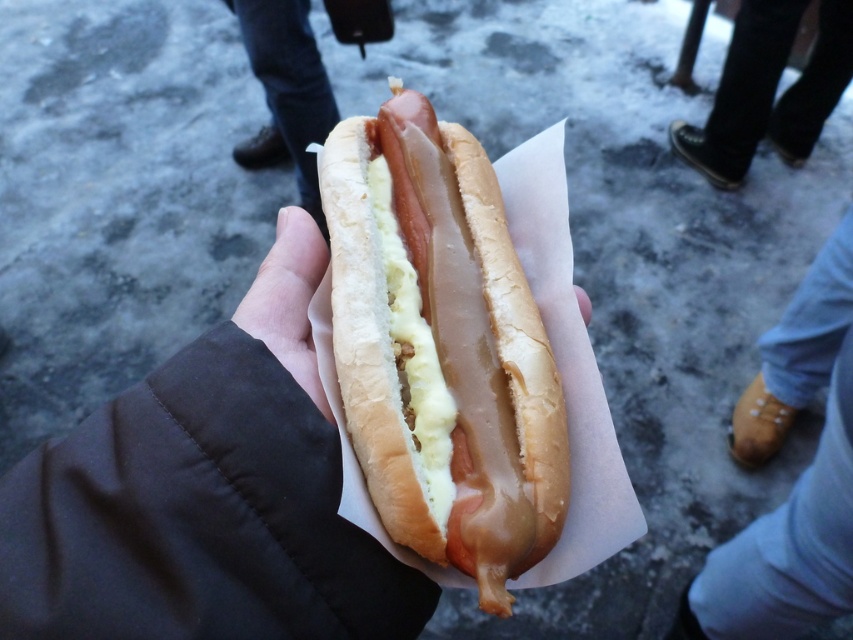
Does slightly toasted bun at center lie behind white smooth skin at center?

No, it is in front of white smooth skin at center.

Is slightly toasted bun at center to the left of white smooth skin at center from the viewer's perspective?

No, slightly toasted bun at center is not to the left of white smooth skin at center.

Is point (378, 147) farther from camera compared to point (248, 317)?

That is True.

The height and width of the screenshot is (640, 853). In order to click on slightly toasted bun at center in this screenshot , I will do `click(444, 349)`.

Who is lower down, slightly toasted bun at center or black leather shoes at lower right?

slightly toasted bun at center is below.

Which of these two, slightly toasted bun at center or black leather shoes at lower right, stands shorter?

Standing shorter between the two is slightly toasted bun at center.

Who is more forward, (465, 451) or (833, 42)?

Point (465, 451) is in front.

Find the location of a particular element. This screenshot has width=853, height=640. slightly toasted bun at center is located at coordinates (444, 349).

Does black leather shoes at lower right appear under white smooth skin at center?

Incorrect, black leather shoes at lower right is not positioned below white smooth skin at center.

Which is in front, point (717, 168) or point (285, 280)?

Point (285, 280) is in front.

Which is behind, point (813, 52) or point (279, 221)?

Point (813, 52)

Where is `black leather shoes at lower right`? Image resolution: width=853 pixels, height=640 pixels. black leather shoes at lower right is located at coordinates (769, 90).